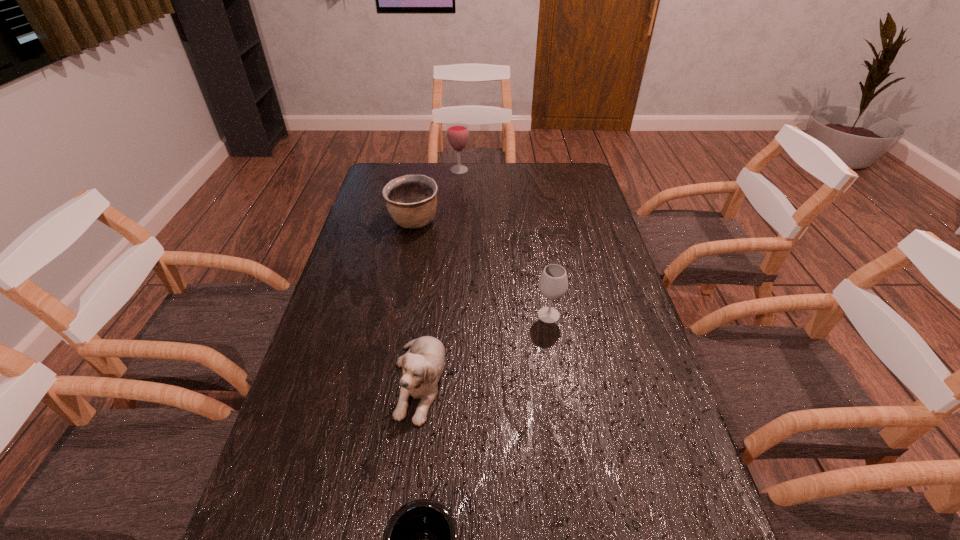
The height and width of the screenshot is (540, 960). Find the location of `blank region between the right wineglass and the left wineglass`. blank region between the right wineglass and the left wineglass is located at coordinates (504, 242).

I want to click on free space between the nearer wineglass and the fourth nearest object, so click(481, 268).

Find the location of a particular element. Image resolution: width=960 pixels, height=540 pixels. empty space that is in between the puppy and the farthest object is located at coordinates (439, 275).

Identify which object is the closest to the third nearest object. Please provide its 2D coordinates. Your answer should be formatted as a tuple, i.e. [(x, y)], where the tuple contains the x and y coordinates of a point satisfying the conditions above.

[(422, 365)]

Where is `object that is the closest to the fourth farthest object`? The height and width of the screenshot is (540, 960). object that is the closest to the fourth farthest object is located at coordinates (421, 539).

Find the location of `free location that satisfies the following two spatial constraints: 1. on the front side of the shorter wineglass; 2. on the left side of the farthest object`. free location that satisfies the following two spatial constraints: 1. on the front side of the shorter wineglass; 2. on the left side of the farthest object is located at coordinates (448, 315).

Image resolution: width=960 pixels, height=540 pixels. Identify the location of vacant space that satisfies the following two spatial constraints: 1. on the back side of the pottery; 2. on the right side of the left wineglass. (424, 170).

Where is `free location that satisfies the following two spatial constraints: 1. on the front side of the nearer wineglass; 2. on the left side of the pottery`? free location that satisfies the following two spatial constraints: 1. on the front side of the nearer wineglass; 2. on the left side of the pottery is located at coordinates (396, 315).

Where is `vacant space that satisfies the following two spatial constraints: 1. on the back side of the pottery; 2. on the right side of the farther wineglass`? vacant space that satisfies the following two spatial constraints: 1. on the back side of the pottery; 2. on the right side of the farther wineglass is located at coordinates (424, 170).